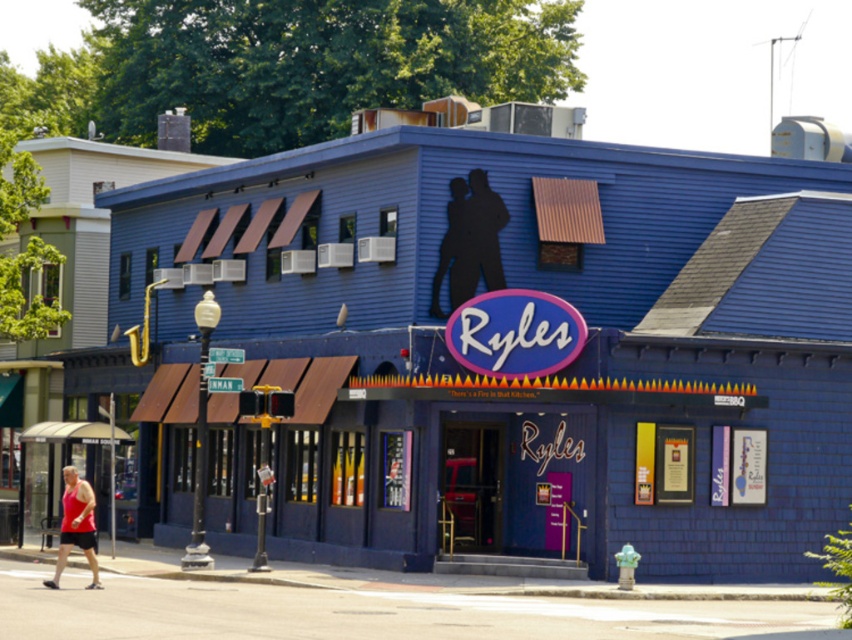
Is blue wooden shed at lower left wider than red tank top at lower left?

Correct, the width of blue wooden shed at lower left exceeds that of red tank top at lower left.

Image resolution: width=852 pixels, height=640 pixels. What do you see at coordinates (517, 346) in the screenshot? I see `blue wooden shed at lower left` at bounding box center [517, 346].

Is point (528, 163) positioned in front of point (61, 568)?

That is False.

At what (x,y) coordinates should I click in order to perform the action: click on blue wooden shed at lower left. Please return your answer as a coordinate pair (x, y). This screenshot has height=640, width=852. Looking at the image, I should click on (x=517, y=346).